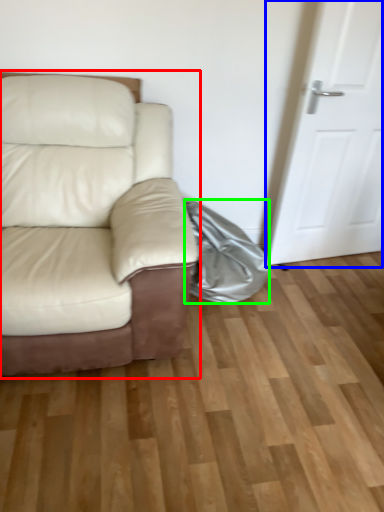
Question: Based on their relative distances, which object is farther from studio couch (highlighted by a red box)? Choose from door (highlighted by a blue box) and material (highlighted by a green box).

Choices:
 (A) door
 (B) material

Answer: (A)